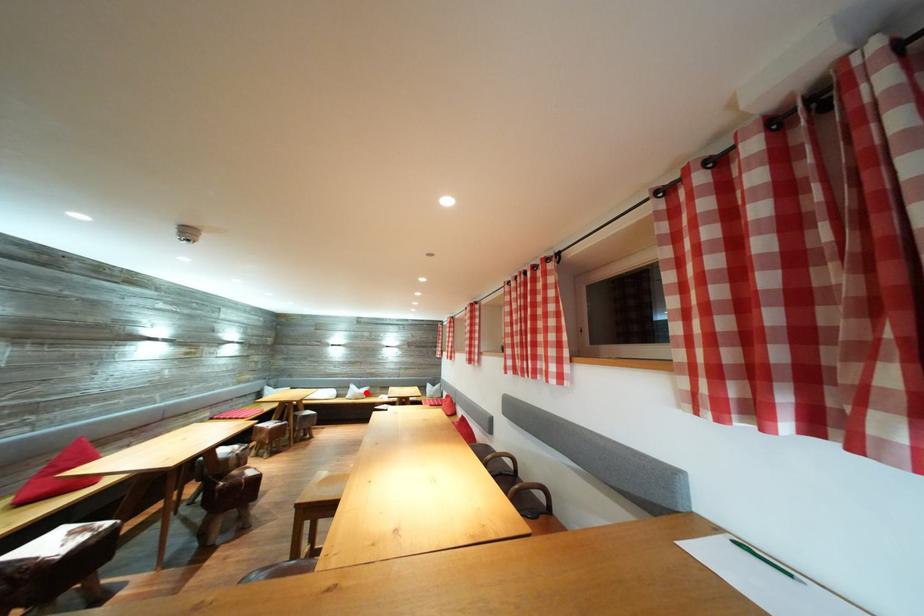
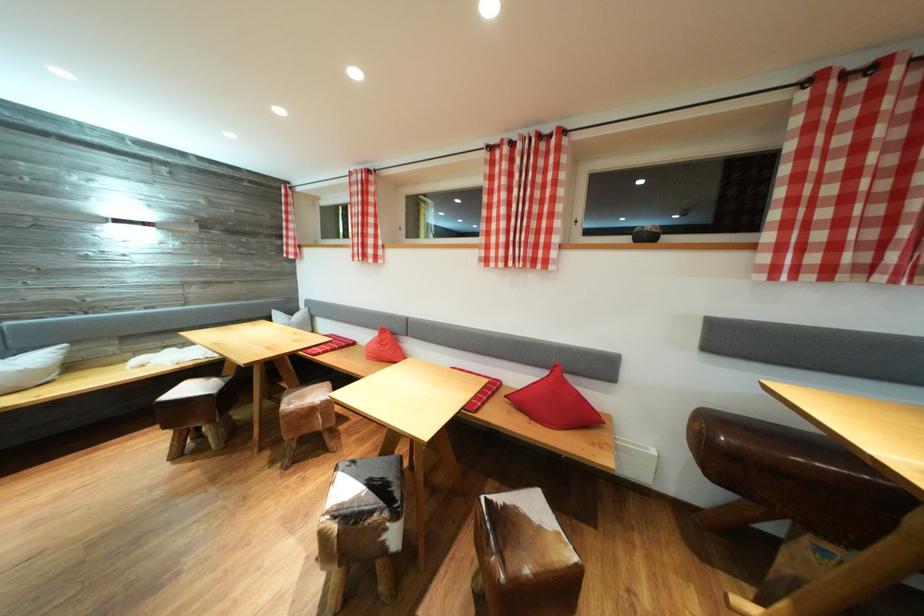
Find the pixel in the second image that matches the highlighted location in the first image.

(14, 358)